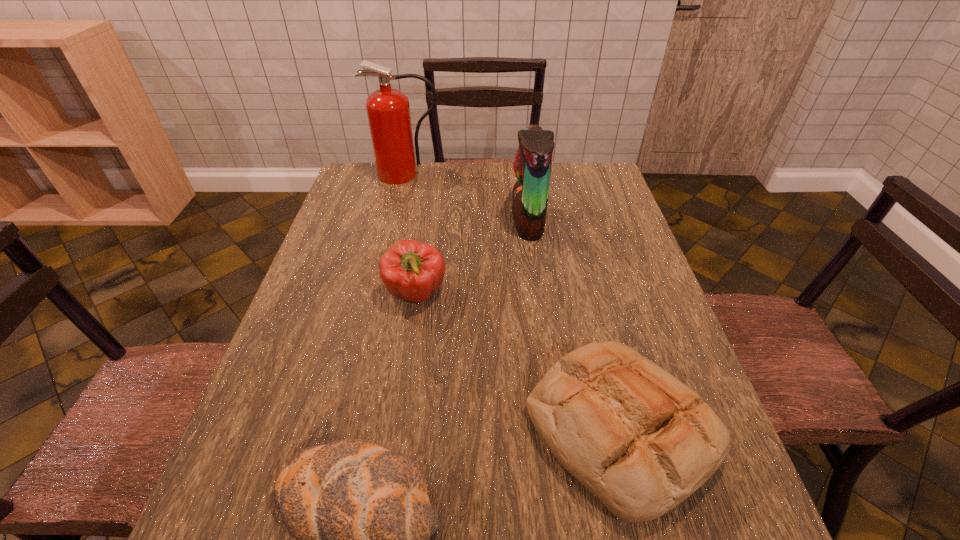
Where is `vacant space situated on the right of the bell pepper`? The width and height of the screenshot is (960, 540). vacant space situated on the right of the bell pepper is located at coordinates (564, 294).

At what (x,y) coordinates should I click in order to perform the action: click on free location located on the back of the right bread. Please return your answer as a coordinate pair (x, y). The width and height of the screenshot is (960, 540). Looking at the image, I should click on (594, 327).

Identify the location of object at the far edge. This screenshot has height=540, width=960. (388, 110).

Locate an element on the screen. The width and height of the screenshot is (960, 540). object located at the near edge is located at coordinates (640, 440).

Identify the location of object that is at the left edge. This screenshot has width=960, height=540. (388, 110).

Identify the location of object that is at the right edge. (640, 440).

In order to click on object present at the far left corner in this screenshot , I will do `click(388, 110)`.

Locate an element on the screen. This screenshot has height=540, width=960. object that is at the near right corner is located at coordinates (640, 440).

In the image, there is a desktop. Find the location of `vacant space at the far edge`. vacant space at the far edge is located at coordinates (468, 172).

This screenshot has height=540, width=960. Identify the location of vacant area at the near edge. (547, 529).